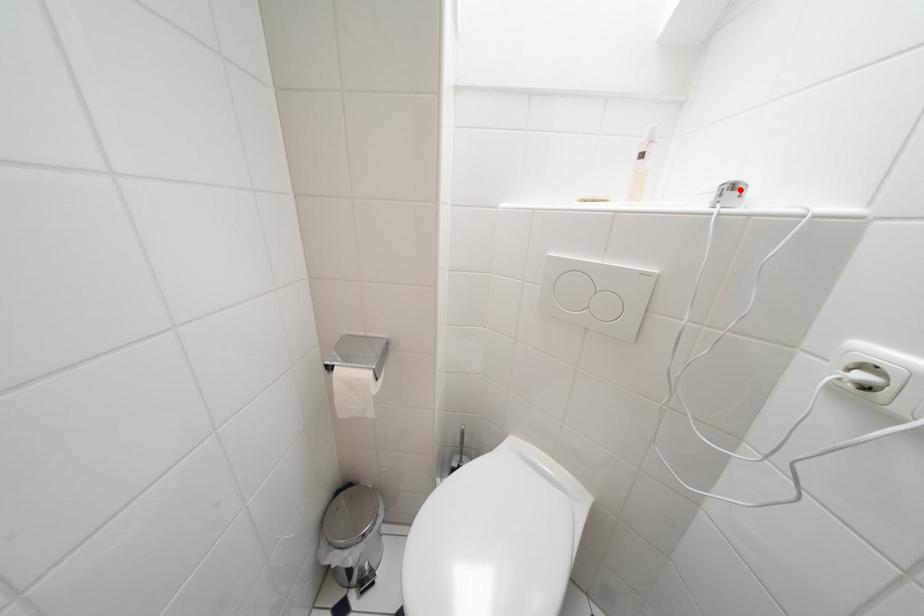
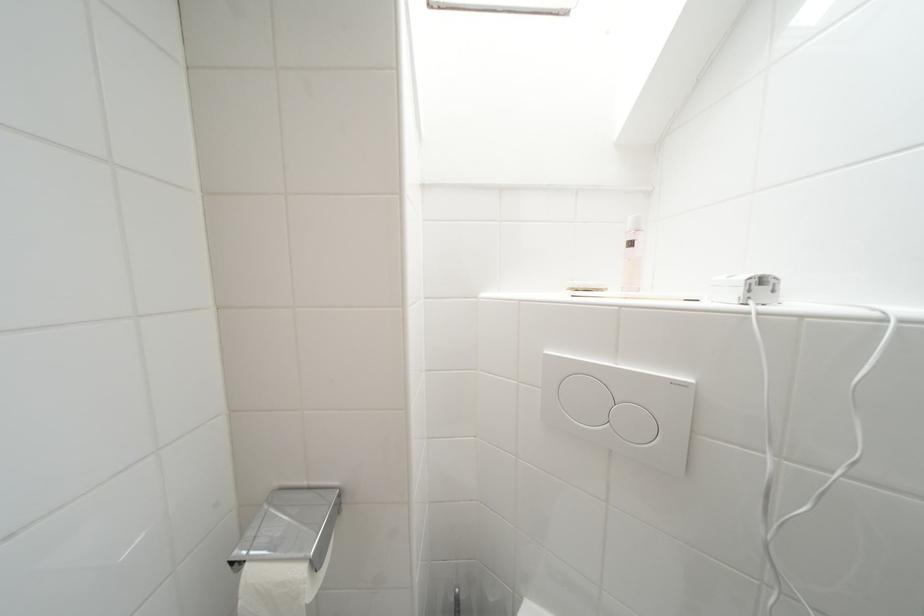
The point at the highlighted location is marked in the first image. Where is the corresponding point in the second image?

(769, 283)